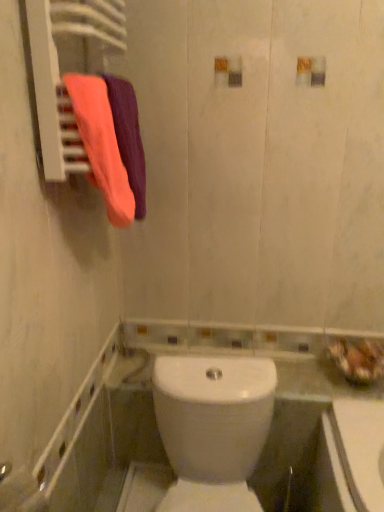
Question: Should I look upward or downward to see orange cotton towel at upper left, the second bath towel positioned from the front?

Choices:
 (A) up
 (B) down

Answer: (A)

Question: From a real-world perspective, is white glossy toilet at center on top of matte pink towel at left, the 1th bath towel in the front-to-back sequence?

Choices:
 (A) yes
 (B) no

Answer: (B)

Question: Is white glossy toilet at center placed right next to matte pink towel at left, the 2th bath towel from the back?

Choices:
 (A) yes
 (B) no

Answer: (B)

Question: Is white glossy toilet at center not close to matte pink towel at left, the 1th bath towel in the front-to-back sequence?

Choices:
 (A) yes
 (B) no

Answer: (B)

Question: Does white glossy toilet at center have a smaller size compared to matte pink towel at left, the 1th bath towel in the front-to-back sequence?

Choices:
 (A) yes
 (B) no

Answer: (B)

Question: Is matte pink towel at left, the 2th bath towel from the back, at the back of white glossy toilet at center?

Choices:
 (A) yes
 (B) no

Answer: (B)

Question: From the image's perspective, is white glossy toilet at center on matte pink towel at left, the 2th bath towel from the back?

Choices:
 (A) yes
 (B) no

Answer: (B)

Question: From the image's perspective, is matte pink towel at left, the 1th bath towel in the front-to-back sequence, above white glossy toilet at center?

Choices:
 (A) yes
 (B) no

Answer: (A)

Question: From the image's perspective, is matte pink towel at left, the 2th bath towel from the back, below white glossy toilet at center?

Choices:
 (A) no
 (B) yes

Answer: (A)

Question: Is matte pink towel at left, the 1th bath towel in the front-to-back sequence, taller than white glossy toilet at center?

Choices:
 (A) no
 (B) yes

Answer: (A)

Question: Could white glossy toilet at center be considered to be inside matte pink towel at left, the 1th bath towel in the front-to-back sequence?

Choices:
 (A) no
 (B) yes

Answer: (A)

Question: Is matte pink towel at left, the 2th bath towel from the back, aimed at white glossy toilet at center?

Choices:
 (A) no
 (B) yes

Answer: (A)

Question: Does matte pink towel at left, the 1th bath towel in the front-to-back sequence, come behind white glossy toilet at center?

Choices:
 (A) yes
 (B) no

Answer: (A)

Question: Is orange cotton towel at upper left, which is counted as the 1th bath towel, starting from the back, further to the viewer compared to white glossy toilet at center?

Choices:
 (A) no
 (B) yes

Answer: (B)